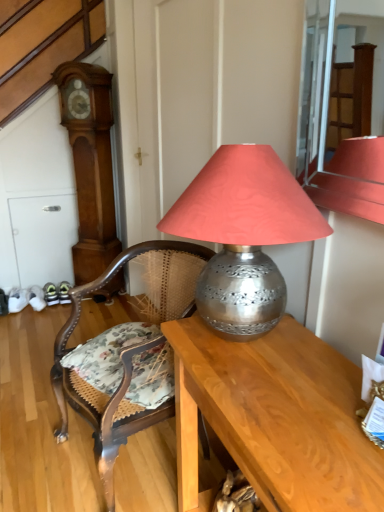
Where is `free location above wooden desk at center (from a real-world perspective)`? free location above wooden desk at center (from a real-world perspective) is located at coordinates (285, 384).